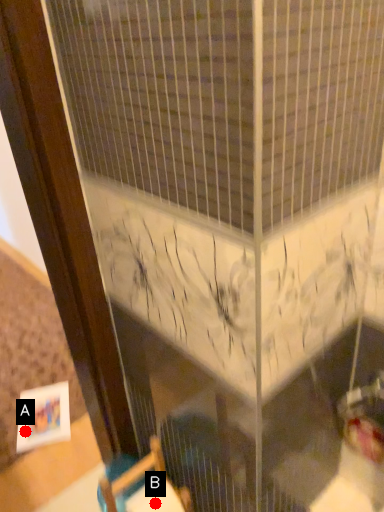
Question: Two points are circled on the image, labeled by A and B beside each circle. Among these points, which one is farthest from the camera?

Choices:
 (A) A is further
 (B) B is further

Answer: (A)